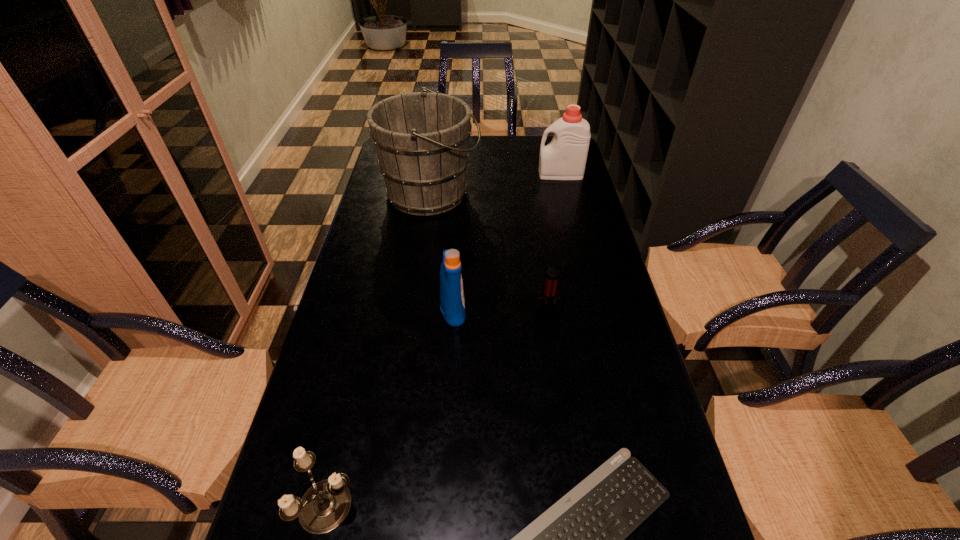
This screenshot has height=540, width=960. I want to click on bucket, so click(421, 138).

Where is `the farther detergent`? The height and width of the screenshot is (540, 960). the farther detergent is located at coordinates (564, 158).

Find the location of `the nearer detergent`. the nearer detergent is located at coordinates (452, 304).

Identify the location of microphone. The width and height of the screenshot is (960, 540). (546, 315).

At what (x,y) coordinates should I click in order to perform the action: click on free space located 0.300m on the handle side of the bucket. Please return your answer as a coordinate pair (x, y). The image size is (960, 540). Looking at the image, I should click on (567, 194).

You are a GUI agent. You are given a task and a screenshot of the screen. Output one action in this format:
    pyautogui.click(x=<x>, y=<y>)
    Task: Click on the free space located 0.200m on the handle side of the farther detergent
    Image resolution: width=960 pixels, height=540 pixels.
    Given the screenshot: What is the action you would take?
    pyautogui.click(x=483, y=174)

The height and width of the screenshot is (540, 960). In order to click on vacant space situated 0.140m on the handle side of the farther detergent in this screenshot , I will do `click(499, 174)`.

The height and width of the screenshot is (540, 960). I want to click on free space located 0.230m on the handle side of the farther detergent, so click(475, 174).

In order to click on free space located 0.260m on the label of the nearer detergent in this screenshot , I will do `click(566, 310)`.

This screenshot has width=960, height=540. What are the coordinates of `vacant space located 0.060m on the right of the microphone` in the screenshot? It's located at pyautogui.click(x=587, y=316).